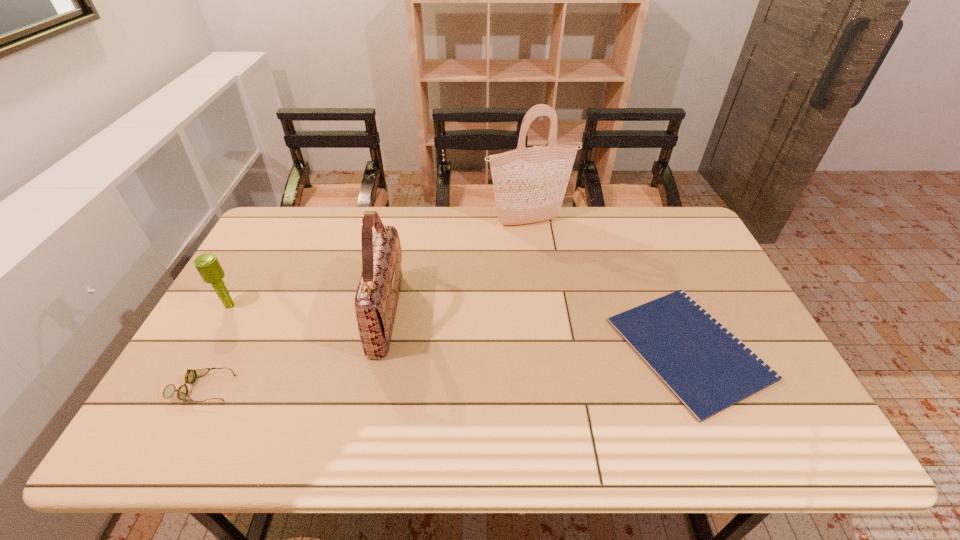
The width and height of the screenshot is (960, 540). What are the coordinates of `free space located 0.270m on the right of the third shortest object` in the screenshot? It's located at (333, 305).

Locate an element on the screen. free space located on the front-facing side of the spectacles is located at coordinates point(383,388).

Locate an element on the screen. Image resolution: width=960 pixels, height=540 pixels. vacant space located 0.290m on the back of the notepad is located at coordinates [638, 233].

This screenshot has height=540, width=960. In order to click on object at the far edge in this screenshot , I will do `click(529, 184)`.

Identify the location of object at the near edge. The height and width of the screenshot is (540, 960). (706, 367).

Locate an element on the screen. microphone that is at the left edge is located at coordinates (208, 266).

This screenshot has width=960, height=540. I want to click on spectacles located at the left edge, so (191, 375).

The height and width of the screenshot is (540, 960). What are the coordinates of `object that is at the right edge` in the screenshot? It's located at (706, 367).

The width and height of the screenshot is (960, 540). Identify the location of object present at the near right corner. [706, 367].

Where is `vacant space at the far edge of the desktop`? The width and height of the screenshot is (960, 540). vacant space at the far edge of the desktop is located at coordinates (337, 240).